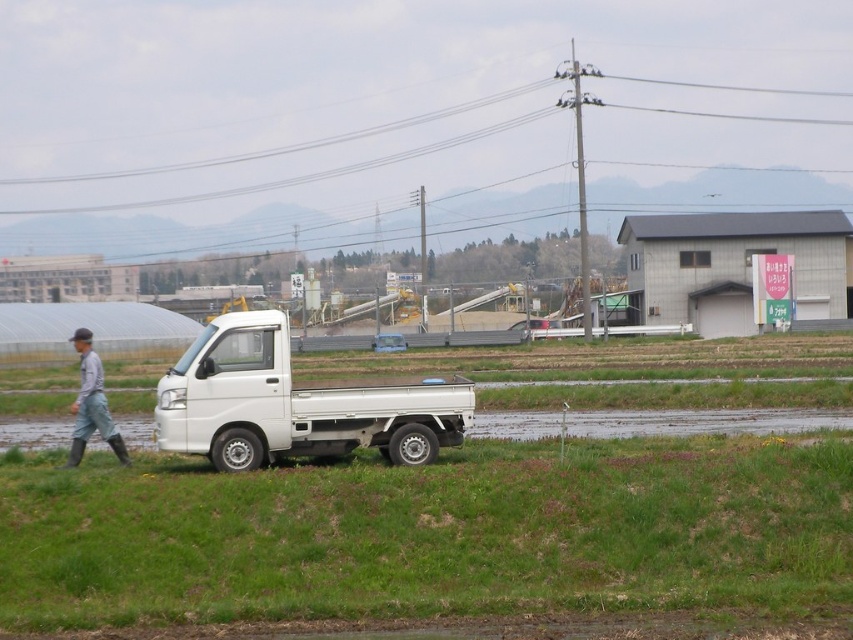
Does green grass at lower center have a greater width compared to gray fabric pants at left?

In fact, green grass at lower center might be narrower than gray fabric pants at left.

Does green grass at lower center have a lesser width compared to gray fabric pants at left?

Yes.

Does point (660, 509) come farther from viewer compared to point (71, 404)?

That is False.

Locate an element on the screen. This screenshot has width=853, height=640. green grass at lower center is located at coordinates (428, 532).

Which is behind, point (352, 580) or point (337, 387)?

The point (337, 387) is more distant.

Who is positioned more to the right, green grass at lower center or white matte truck at center?

Positioned to the right is green grass at lower center.

The height and width of the screenshot is (640, 853). What do you see at coordinates (428, 532) in the screenshot?
I see `green grass at lower center` at bounding box center [428, 532].

The image size is (853, 640). Find the location of `green grass at lower center`. green grass at lower center is located at coordinates (428, 532).

Is white matte truck at center positioned at the back of gray fabric pants at left?

No, it is not.

Which of these two, white matte truck at center or gray fabric pants at left, stands taller?

With more height is gray fabric pants at left.

Who is more distant from viewer, (x=157, y=387) or (x=73, y=440)?

Positioned behind is point (x=157, y=387).

Where is `white matte truck at center`? The image size is (853, 640). white matte truck at center is located at coordinates (293, 403).